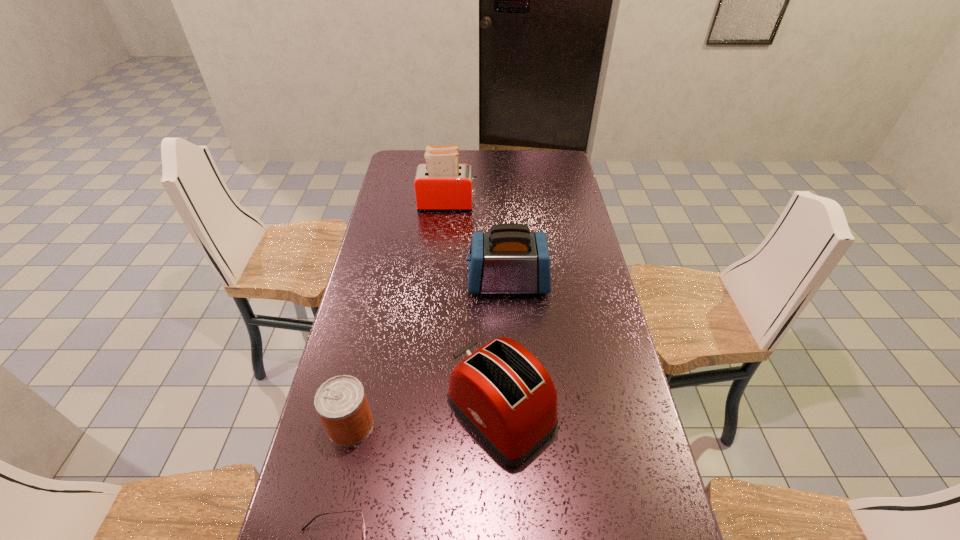
This screenshot has height=540, width=960. Identify the location of the closest object to the fourth nearest object. (506, 396).

Identify which object is located as the fourth nearest to the farthest object. Please provide its 2D coordinates. Your answer should be formatted as a tuple, i.e. [(x, y)], where the tuple contains the x and y coordinates of a point satisfying the conditions above.

[(363, 533)]

Select which toaster appears as the closest to the farthest toaster. Please provide its 2D coordinates. Your answer should be formatted as a tuple, i.e. [(x, y)], where the tuple contains the x and y coordinates of a point satisfying the conditions above.

[(509, 259)]

Locate which toaster is the second closest to the nearest toaster. Please provide its 2D coordinates. Your answer should be formatted as a tuple, i.e. [(x, y)], where the tuple contains the x and y coordinates of a point satisfying the conditions above.

[(442, 184)]

Where is `vacant area in the image that satisfies the following two spatial constraints: 1. on the front-facing side of the farthest toaster; 2. on the right side of the nearest toaster`? Image resolution: width=960 pixels, height=540 pixels. vacant area in the image that satisfies the following two spatial constraints: 1. on the front-facing side of the farthest toaster; 2. on the right side of the nearest toaster is located at coordinates (429, 413).

This screenshot has width=960, height=540. Identify the location of free space in the image that satisfies the following two spatial constraints: 1. on the front-facing side of the farthest object; 2. on the right side of the nearest toaster. (429, 413).

The width and height of the screenshot is (960, 540). What are the coordinates of `vacant area in the image that satisfies the following two spatial constraints: 1. on the front-facing side of the farthest toaster; 2. on the left side of the nearest toaster` in the screenshot? It's located at [429, 413].